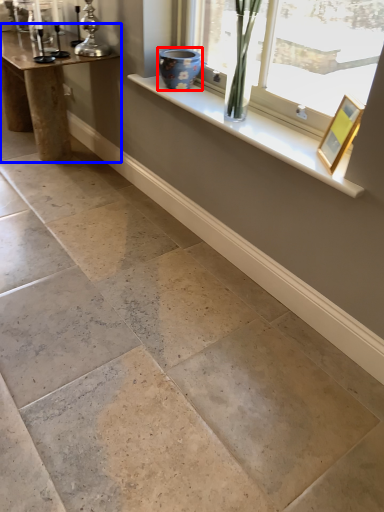
Question: Among these objects, which one is nearest to the camera, vase (highlighted by a red box) or table (highlighted by a blue box)?

Choices:
 (A) vase
 (B) table

Answer: (A)